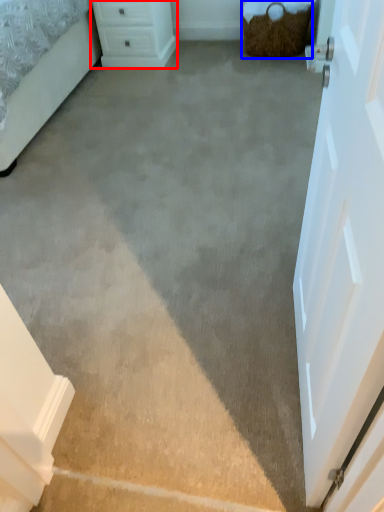
Question: Which of the following is the farthest to the observer, chest of drawers (highlighted by a red box) or basket (highlighted by a blue box)?

Choices:
 (A) chest of drawers
 (B) basket

Answer: (A)